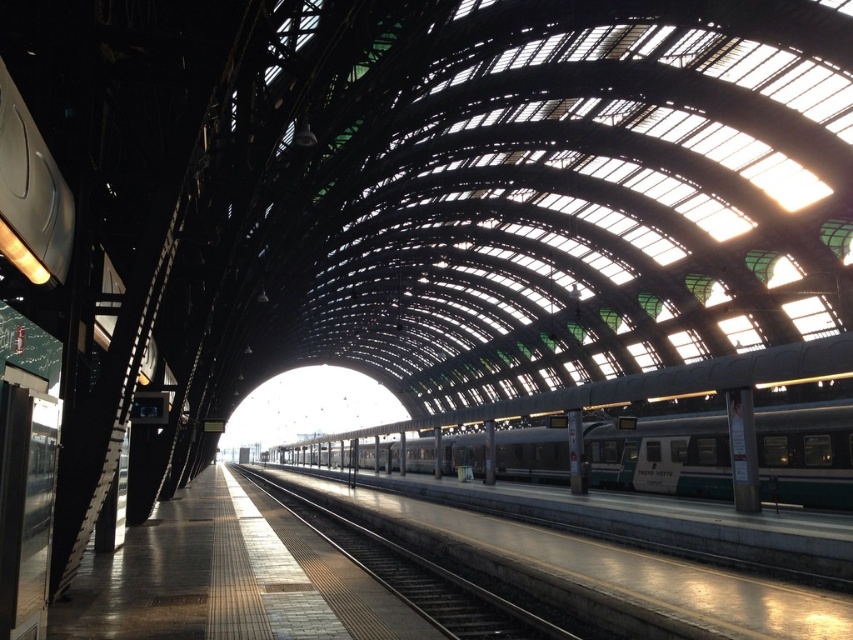
You are a maintenance worker checking the clearance height of the teal metallic train at center and the metal train track at center. Which object has a greater height?

The teal metallic train at center is much taller than the metal train track at center, so the teal metallic train at center has a greater height.

From the picture: You are standing on the platform and want to board the teal metallic train at center. Which direction should you walk to reach it from the metal train track at center?

The metal train track at center is behind the teal metallic train at center, so you should walk forward towards the teal metallic train at center to reach it.

You are a maintenance worker needing to place a 1.2 meter wide equipment on the platform. The equipment must be placed between the teal metallic train at center and the metal train track at center. Can you fit the equipment there?

The teal metallic train at center is wider than the metal train track at center. Therefore, the equipment of 1.2 meters may not fit between them as the space between might be narrower than the equipment.